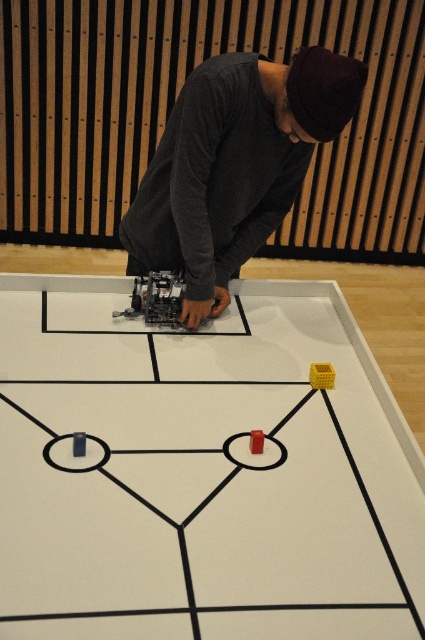
Question: Which of the following is the closest to the observer?

Choices:
 (A) (187, 236)
 (B) (201, 579)

Answer: (B)

Question: Does matte plastic board game at center appear on the left side of dark gray sweater at center?

Choices:
 (A) yes
 (B) no

Answer: (A)

Question: Can you confirm if matte plastic board game at center is smaller than dark gray sweater at center?

Choices:
 (A) yes
 (B) no

Answer: (B)

Question: Which point is closer to the camera taking this photo?

Choices:
 (A) (254, 612)
 (B) (204, 294)

Answer: (A)

Question: Among these points, which one is nearest to the camera?

Choices:
 (A) (142, 369)
 (B) (218, 186)

Answer: (A)

Question: Does matte plastic board game at center appear on the right side of dark gray sweater at center?

Choices:
 (A) yes
 (B) no

Answer: (B)